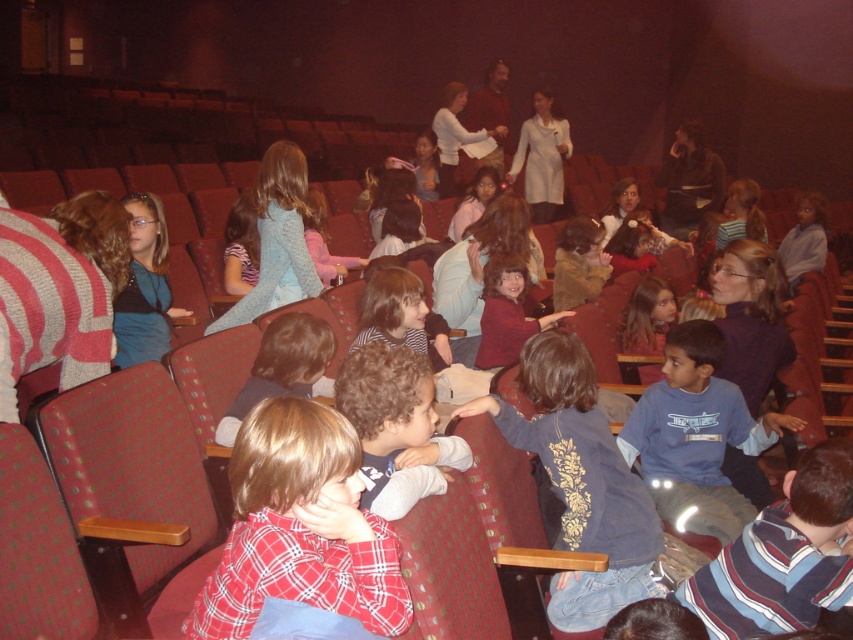
You are a photographer trying to capture a closeup of the white wool sweater at center and the brown fuzzy sweater at center. Since the lighting is dim, you need to adjust your camera settings. Which sweater should you focus on first to ensure both are in focus, considering their positions?

The white wool sweater at center is to the right of the brown fuzzy sweater at center, so you should focus on the brown fuzzy sweater at center first as it is closer to the left side, ensuring both remain in focus.

You are a photographer in the theater and want to take a photo of the matte blue sweater at center and the matte blue shirt at center. Which one should you focus on first if you want to capture the taller object?

The matte blue shirt at center is taller than the matte blue sweater at center, so you should focus on the matte blue shirt at center first.